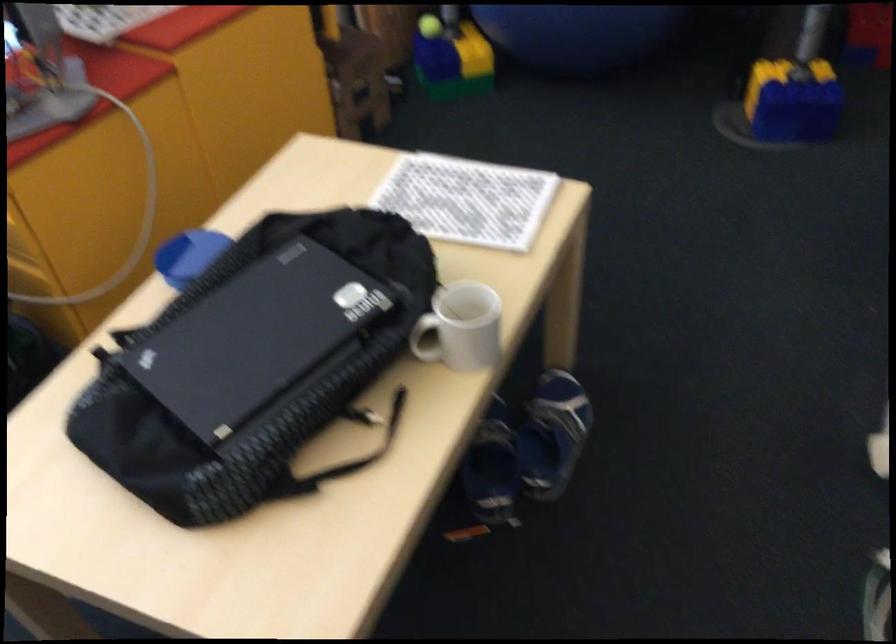
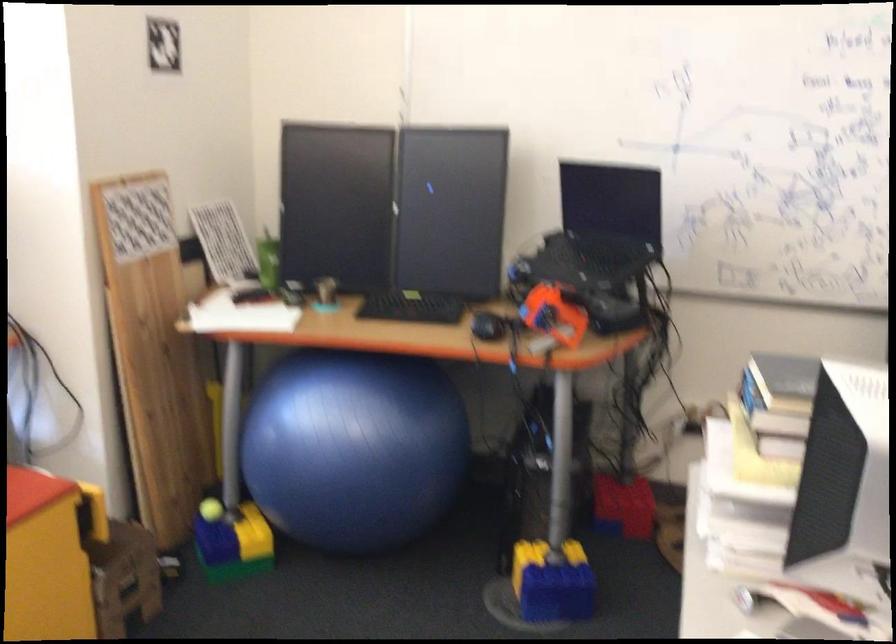
Question: The first image is from the beginning of the video and the second image is from the end. How did the camera likely rotate when shooting the video?

Choices:
 (A) Left
 (B) Right
 (C) Up
 (D) Down

Answer: (C)